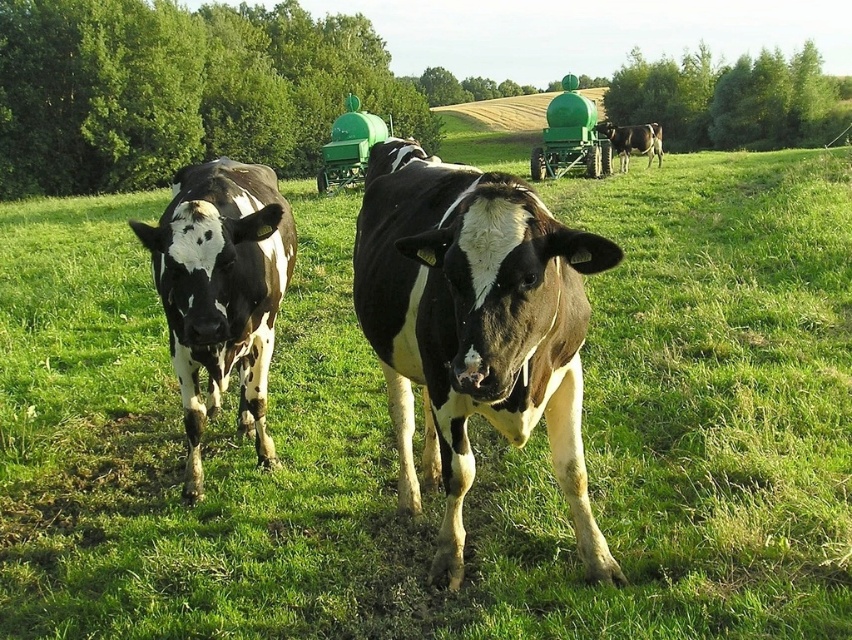
You are a photographer trying to capture both the black and white cow at center and the black and white spotted cow at left in a single frame. Based on their positions, which cow would appear closer to the bottom of the photo?

The black and white cow at center is located below the black and white spotted cow at left, so it would appear closer to the bottom of the photo.

You are standing in the field and want to take a photo of the black and white spotted cow at left. Where should you position yourself to ensure the cow is centered in your camera viewfinder?

To center the black and white spotted cow at left in your camera viewfinder, position yourself directly in front of the cow at its 2D location point at coordinates (222, 291).

You are a farmer who needs to separate the black and white cow at center and the black and white cow at upper right with a fence. What is the minimum length of the fence required to separate them?

The minimum length of the fence required to separate the black and white cow at center and the black and white cow at upper right is 20.44 meters, as they are 20.44 meters apart.